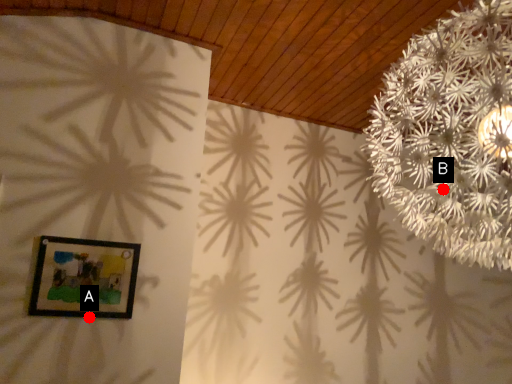
Question: Two points are circled on the image, labeled by A and B beside each circle. Which of the following is the farthest from the observer?

Choices:
 (A) A is further
 (B) B is further

Answer: (A)